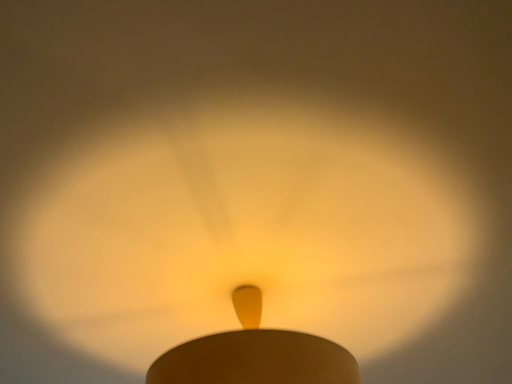
Question: Should I look upward or downward to see matte yellow light at center?

Choices:
 (A) down
 (B) up

Answer: (A)